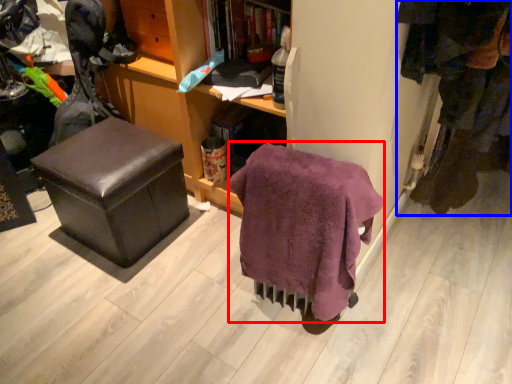
Question: Which of the following is the closest to the observer, blanket (highlighted by a red box) or clothing (highlighted by a blue box)?

Choices:
 (A) blanket
 (B) clothing

Answer: (A)